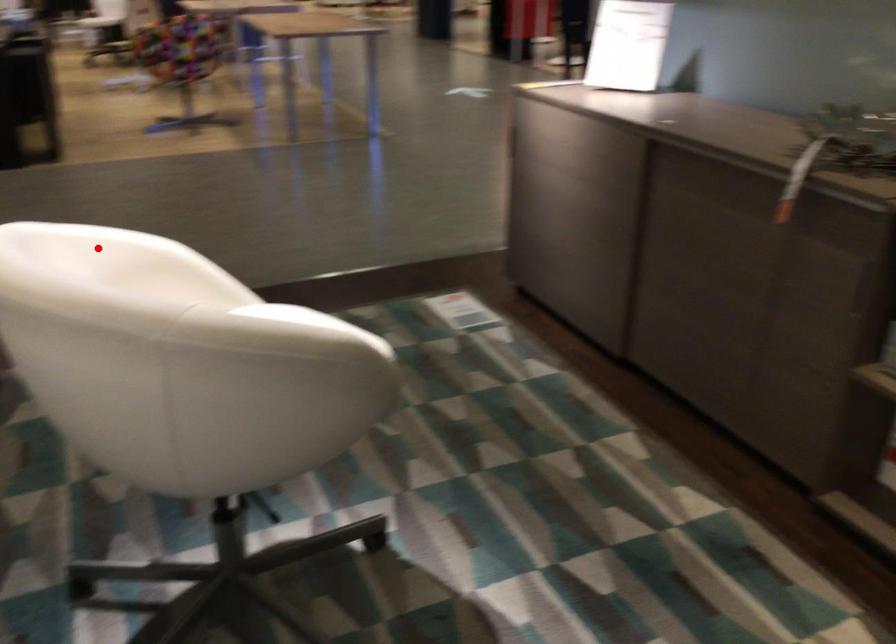
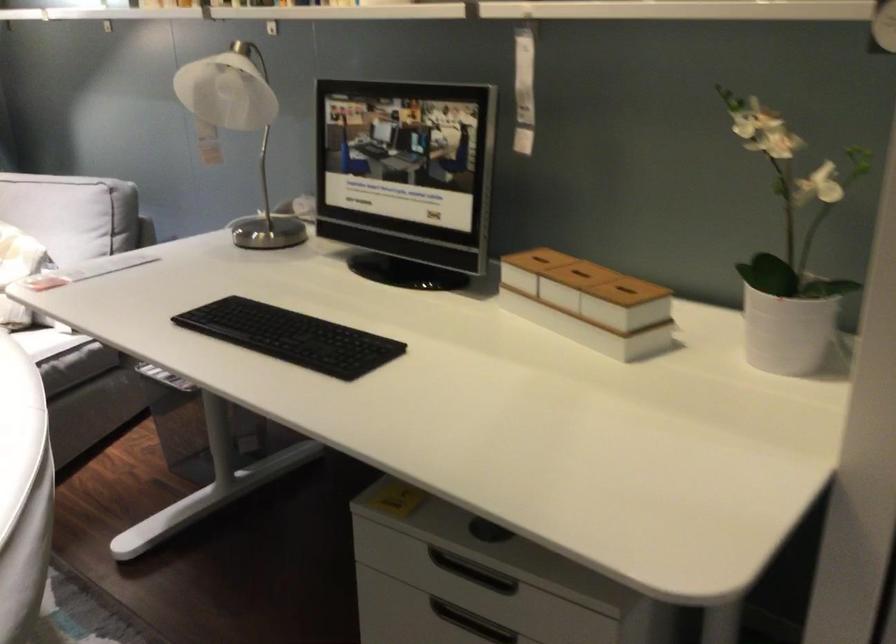
Question: I am providing you with two images of the same scene from different viewpoints. A red point is shown in image1. For the corresponding object point in image2, is it positioned nearer or farther from the camera?

Choices:
 (A) Nearer
 (B) Farther

Answer: (A)